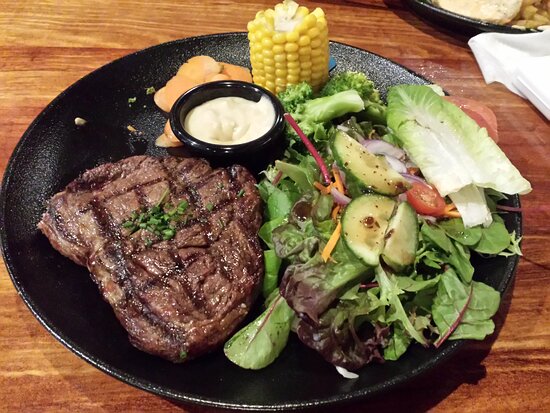
Where is `wood table`? This screenshot has height=413, width=550. wood table is located at coordinates (48, 52).